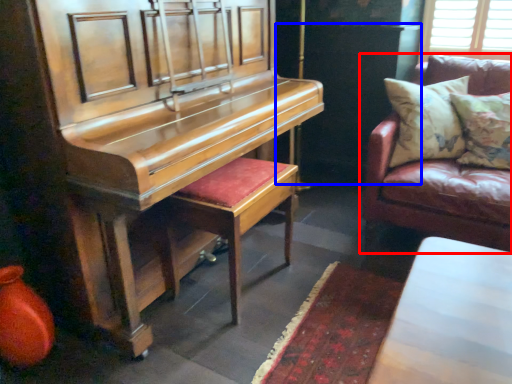
Question: Which point is closer to the camera, studio couch (highlighted by a red box) or dark (highlighted by a blue box)?

Choices:
 (A) studio couch
 (B) dark

Answer: (A)